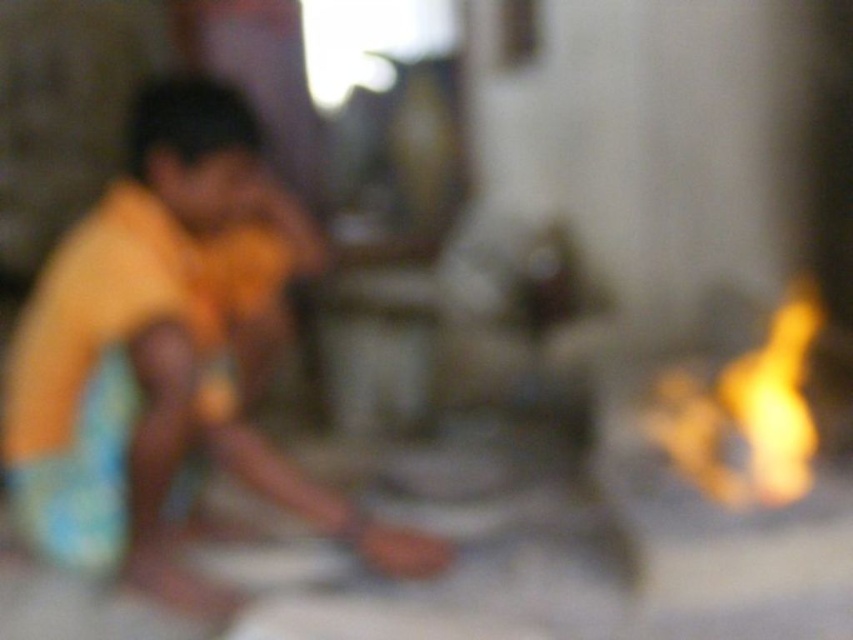
Question: Which point appears closest to the camera in this image?

Choices:
 (A) (125, 388)
 (B) (753, 444)

Answer: (A)

Question: Which of the following is the farthest from the observer?

Choices:
 (A) (13, 433)
 (B) (769, 392)

Answer: (B)

Question: Which point is farther from the camera taking this photo?

Choices:
 (A) (671, 460)
 (B) (163, 481)

Answer: (A)

Question: In this image, where is yellow cotton shirt at left located relative to flame/yellow-orange at right?

Choices:
 (A) below
 (B) above

Answer: (B)

Question: Can you confirm if yellow cotton shirt at left is bigger than flame/yellow-orange at right?

Choices:
 (A) yes
 (B) no

Answer: (A)

Question: Can you confirm if yellow cotton shirt at left is positioned to the right of flame/yellow-orange at right?

Choices:
 (A) yes
 (B) no

Answer: (B)